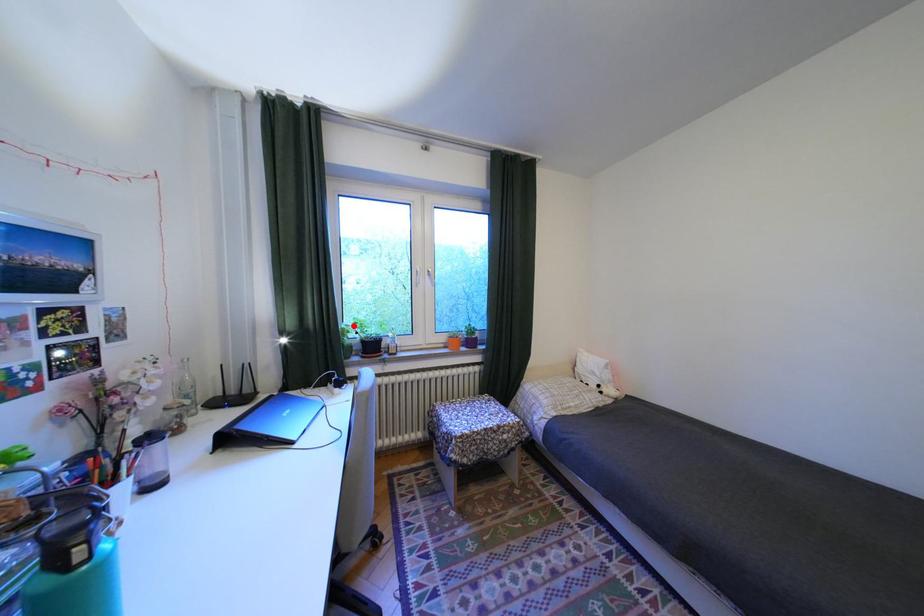
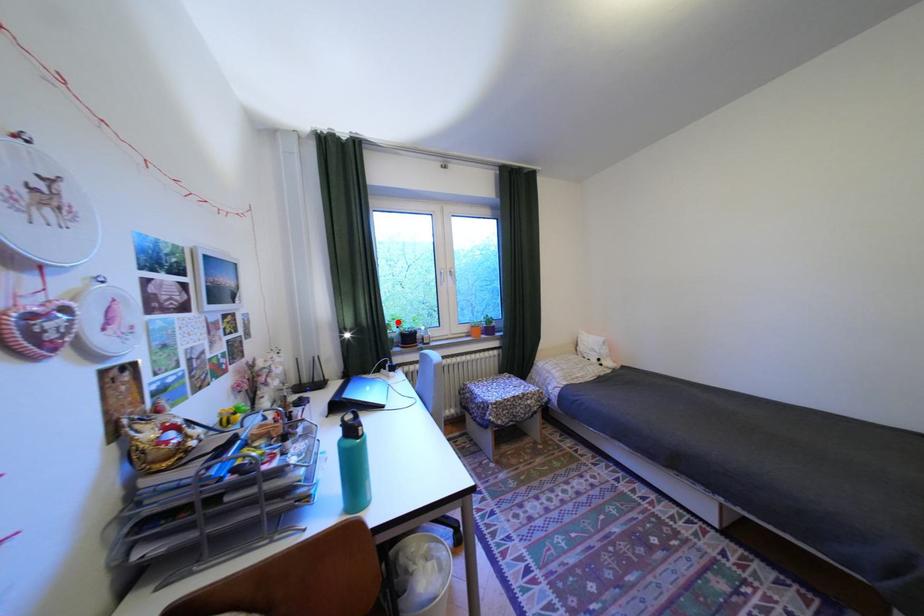
I am providing you with two images of the same scene from different viewpoints. A red point is marked on the first image and another point is marked on the second image. Are the points marked in image1 and image2 representing the same 3D position?

Yes